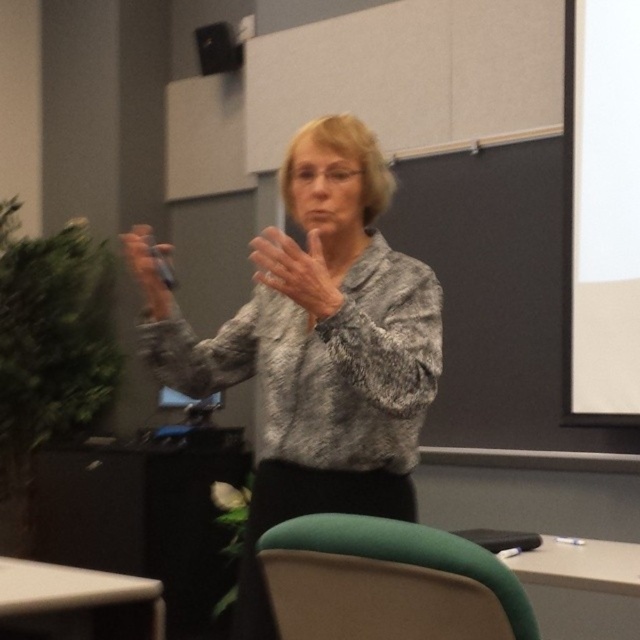
Question: Which object appears farthest from the camera in this image?

Choices:
 (A) gray textured blouse at center
 (B) gray textured sweater at center

Answer: (B)

Question: Is gray textured blouse at center smaller than green fabric chair at lower center?

Choices:
 (A) no
 (B) yes

Answer: (A)

Question: Which object is the closest to the gray textured blouse at center?

Choices:
 (A) gray textured sweater at center
 (B) white matte projection screen at upper right
 (C) green fabric chair at lower center
 (D) matte black speaker at upper center

Answer: (A)

Question: Which point is closer to the camera?

Choices:
 (A) white matte projection screen at upper right
 (B) green fabric chair at lower center
 (C) matte black remote at upper left
 (D) gray textured sweater at center

Answer: (B)

Question: Does white matte projection screen at upper right have a smaller size compared to green fabric chair at lower center?

Choices:
 (A) yes
 (B) no

Answer: (B)

Question: Can you confirm if green fabric chair at lower center is thinner than matte black speaker at upper center?

Choices:
 (A) no
 (B) yes

Answer: (A)